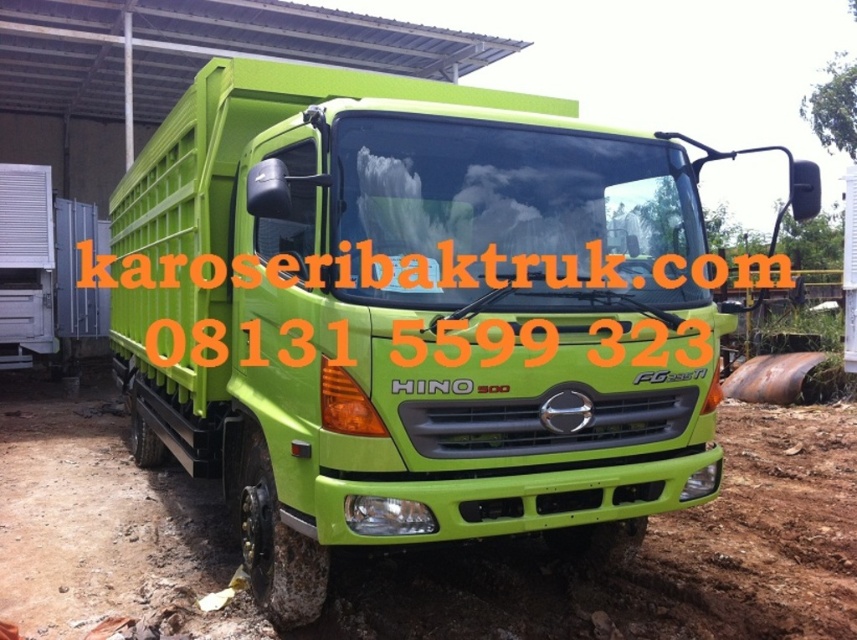
You are standing at the point labeled point [649,557] in the image. What is the color and texture of the ground beneath your feet?

The point corresponds to the green matte dirt field at center, so the ground beneath your feet is green and matte.

What is the coordinate of the green matte dirt field at center?

The green matte dirt field at center is located at coordinate point (649, 557).